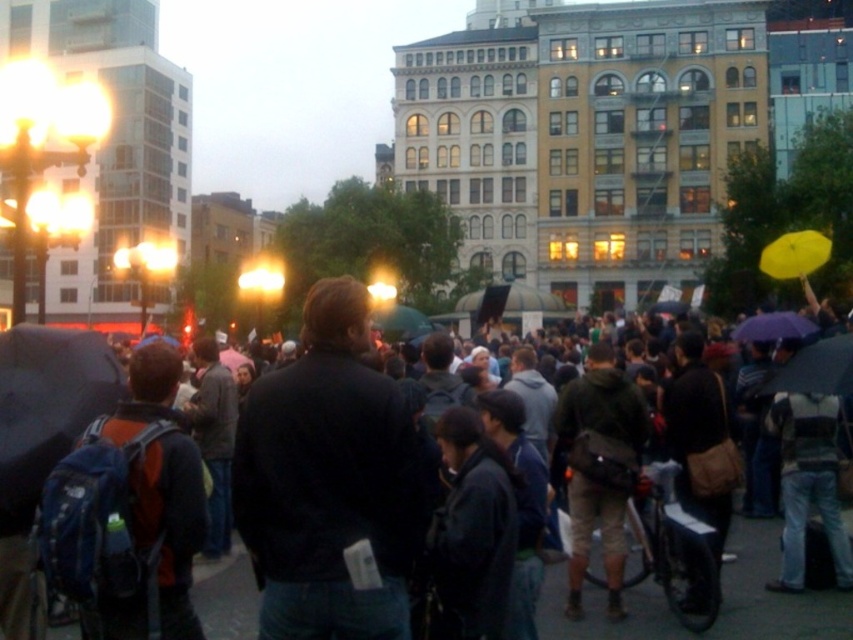
Consider the image. Can you confirm if yellow matte umbrella at upper right is wider than purple matte umbrella at upper right?

No.

Which is more to the right, yellow matte umbrella at upper right or purple matte umbrella at upper right?

yellow matte umbrella at upper right

Based on the photo, who is more forward, [808,273] or [788,323]?

Positioned in front is point [788,323].

At what (x,y) coordinates should I click in order to perform the action: click on yellow matte umbrella at upper right. Please return your answer as a coordinate pair (x, y). Looking at the image, I should click on (793, 253).

Which is in front, point (387, 493) or point (786, 253)?

Positioned in front is point (387, 493).

Locate an element on the screen. black leather jacket at center is located at coordinates (328, 481).

Which is behind, point (253, 486) or point (773, 266)?

The point (773, 266) is more distant.

Identify the location of black leather jacket at center. (328, 481).

Which is in front, point (326, 368) or point (74, 632)?

Positioned in front is point (326, 368).

Consider the image. Can you confirm if black leather jacket at center is smaller than dark blue backpack at center?

No.

Between point (399, 531) and point (563, 572), which one is positioned in front?

Point (399, 531)

You are a GUI agent. You are given a task and a screenshot of the screen. Output one action in this format:
    pyautogui.click(x=<x>, y=<y>)
    Task: Click on the black leather jacket at center
    The height and width of the screenshot is (640, 853).
    Given the screenshot: What is the action you would take?
    pyautogui.click(x=328, y=481)